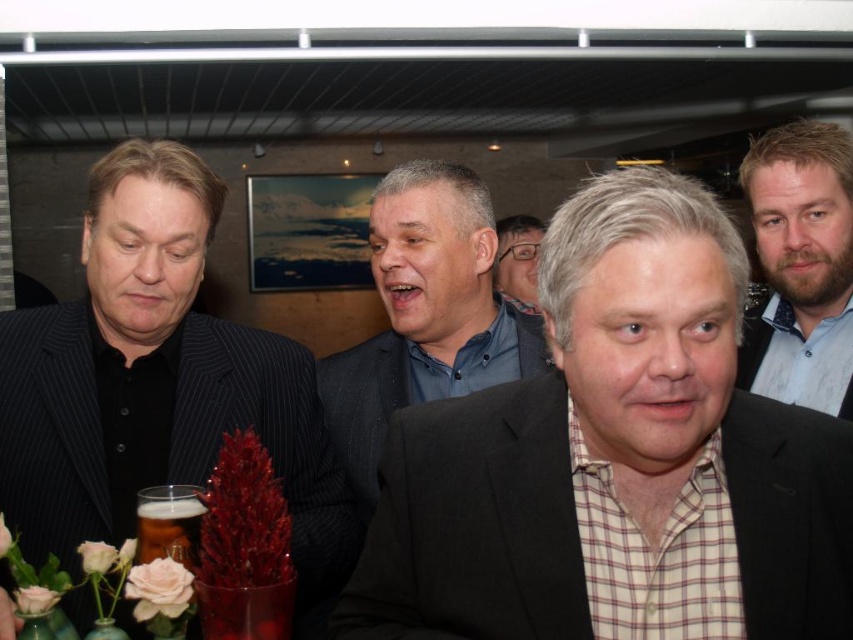
Question: Which of these objects is positioned closest to the matte black glasses at center?

Choices:
 (A) translucent glass beer at lower left
 (B) bearded man at center
 (C) blue textured shirt at upper right
 (D) black pinstripe suit at left

Answer: (C)

Question: In this image, where is bearded man at center located relative to translucent glass beer at lower left?

Choices:
 (A) right
 (B) left

Answer: (A)

Question: Which object is closer to the camera taking this photo?

Choices:
 (A) translucent glass beer at lower left
 (B) black pinstripe suit at left
 (C) blue textured shirt at upper right
 (D) matte black glasses at center

Answer: (A)

Question: Is black pinstripe suit at left behind matte black glasses at center?

Choices:
 (A) no
 (B) yes

Answer: (A)

Question: Is bearded man at center to the left of blue textured shirt at upper right from the viewer's perspective?

Choices:
 (A) yes
 (B) no

Answer: (A)

Question: Which point appears closest to the camera in this image?

Choices:
 (A) (299, 484)
 (B) (787, 176)
 (C) (526, 220)

Answer: (A)